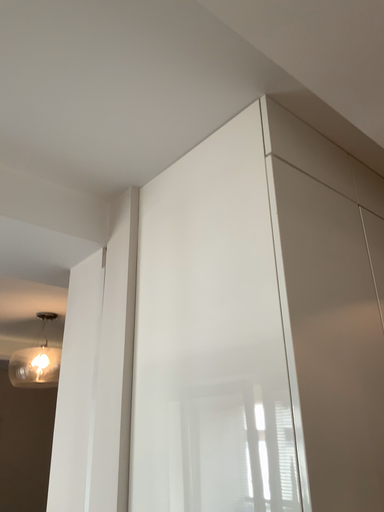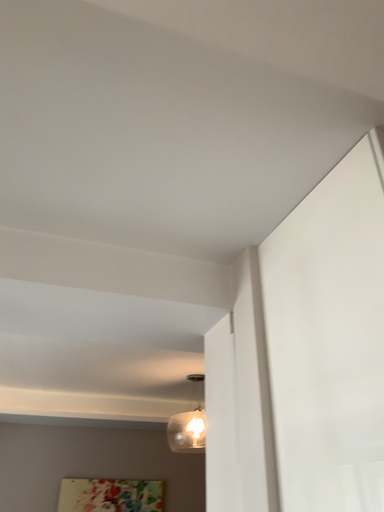
Question: How did the camera likely rotate when shooting the video?

Choices:
 (A) rotated right
 (B) rotated left

Answer: (B)